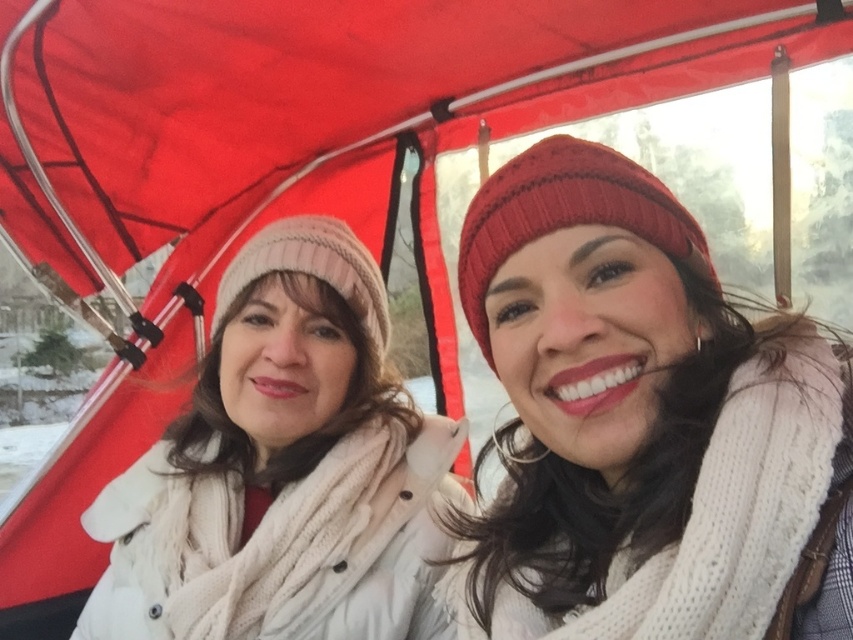
Question: Considering the relative positions of knitted red beanie at upper right and white knit hat at left in the image provided, where is knitted red beanie at upper right located with respect to white knit hat at left?

Choices:
 (A) below
 (B) above

Answer: (B)

Question: Which point is closer to the camera?

Choices:
 (A) white knit hat at left
 (B) knitted red beanie at upper right

Answer: (B)

Question: Observing the image, what is the correct spatial positioning of knitted red beanie at upper right in reference to white knit hat at left?

Choices:
 (A) left
 (B) right

Answer: (B)

Question: Does knitted red beanie at upper right have a smaller size compared to white knit hat at left?

Choices:
 (A) yes
 (B) no

Answer: (A)

Question: Which of the following is the farthest from the observer?

Choices:
 (A) (283, 355)
 (B) (526, 612)

Answer: (A)